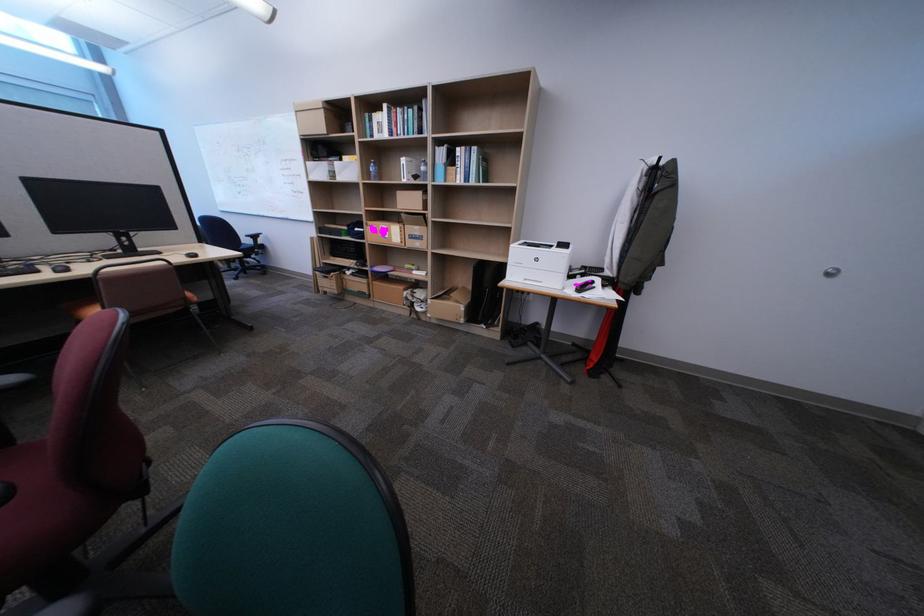
What do you see at coordinates (102, 302) in the screenshot?
I see `the brown chair sitting surface` at bounding box center [102, 302].